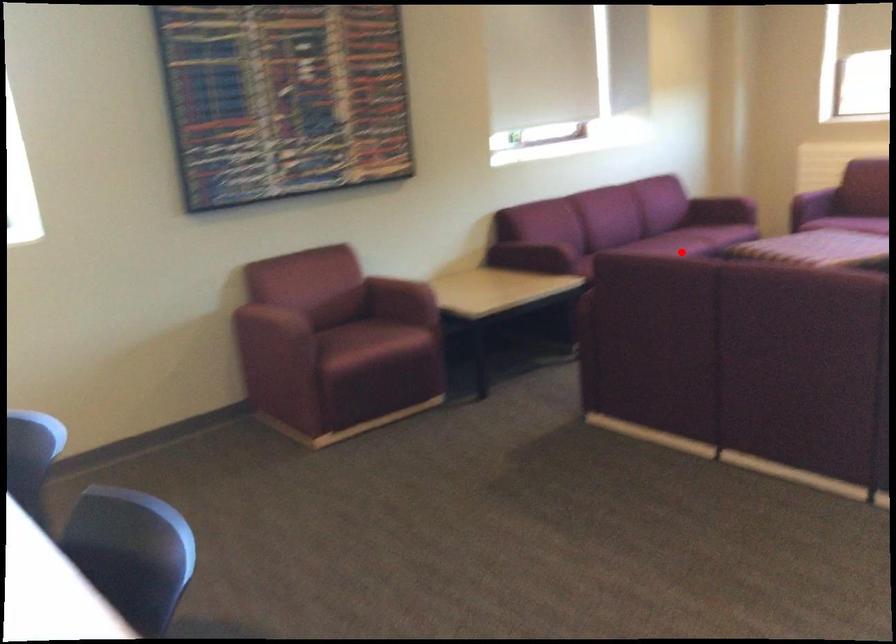
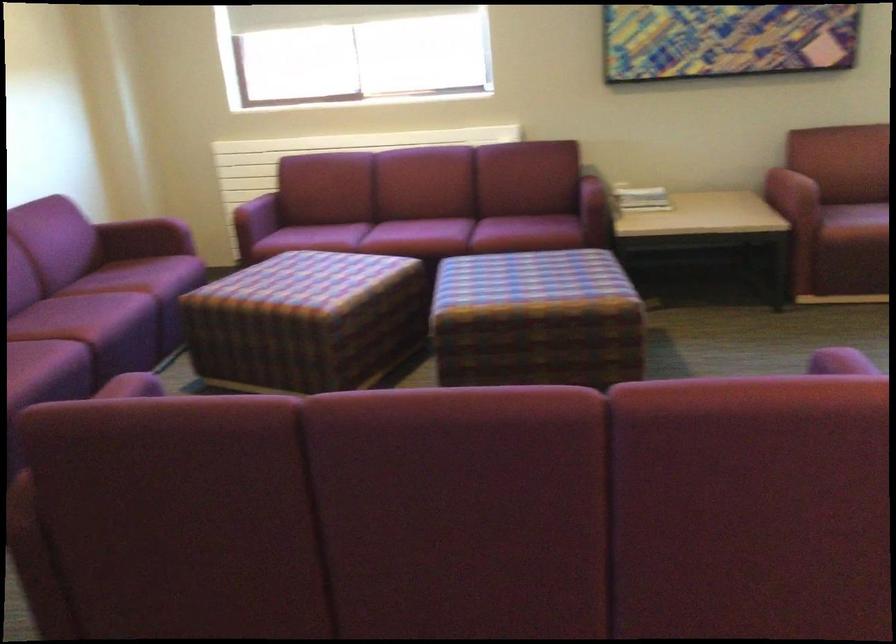
Question: I am providing you with two images of the same scene from different viewpoints. A red point is shown in image1. For the corresponding object point in image2, is it positioned nearer or farther from the camera?

Choices:
 (A) Nearer
 (B) Farther

Answer: (A)